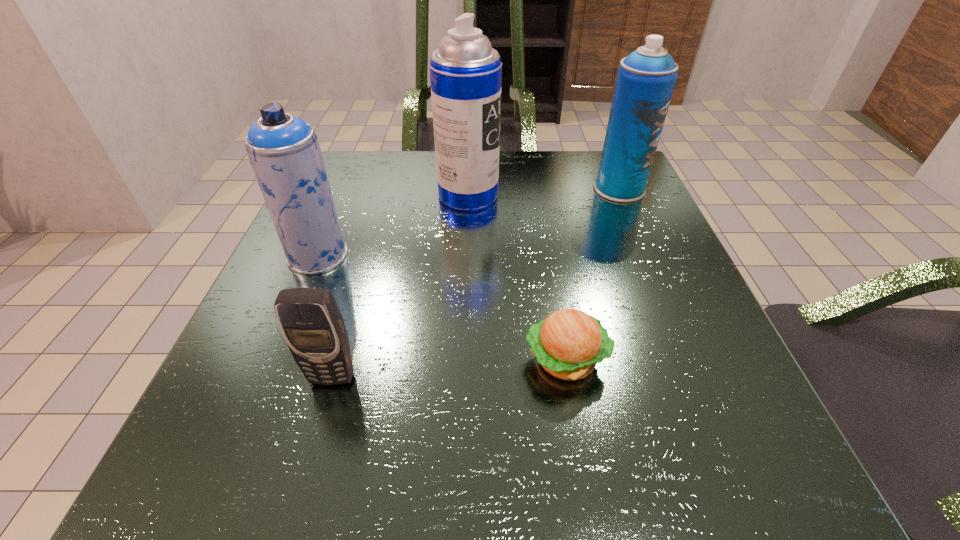
Find the location of a particular element. The image size is (960, 540). the second aerosol can from right to left is located at coordinates [x=465, y=72].

You are a GUI agent. You are given a task and a screenshot of the screen. Output one action in this format:
    pyautogui.click(x=<x>, y=<y>)
    Task: Click on the rightmost object
    This screenshot has height=540, width=960.
    Given the screenshot: What is the action you would take?
    pyautogui.click(x=646, y=78)

Where is `the leftmost object`? the leftmost object is located at coordinates (284, 151).

At what (x,y) coordinates should I click in order to perform the action: click on the nearest aerosol can. Please return your answer as a coordinate pair (x, y). The image size is (960, 540). Looking at the image, I should click on (284, 151).

Identify the location of the second shortest object. (311, 323).

Where is `cellular telephone`? cellular telephone is located at coordinates (311, 323).

The width and height of the screenshot is (960, 540). Find the location of `the fourth object from left to right`. the fourth object from left to right is located at coordinates [568, 344].

Locate an element on the screen. The width and height of the screenshot is (960, 540). the shortest object is located at coordinates (568, 344).

Where is `vacant space located on the label side of the second aerosol can from left to right`? The height and width of the screenshot is (540, 960). vacant space located on the label side of the second aerosol can from left to right is located at coordinates (577, 195).

Identify the location of vacant space located 0.280m on the left of the rightmost aerosol can. (467, 188).